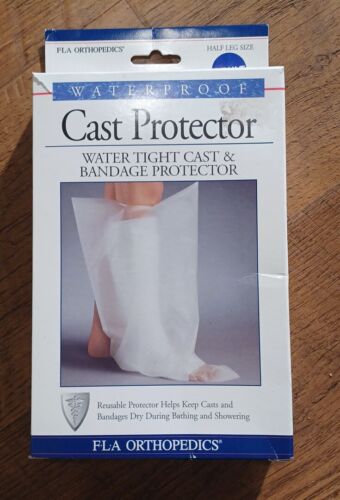
At what (x,y) coordinates should I click in order to perform the action: click on box. Please return your answer as a coordinate pair (x, y). This screenshot has height=500, width=340. Looking at the image, I should click on (279, 411).